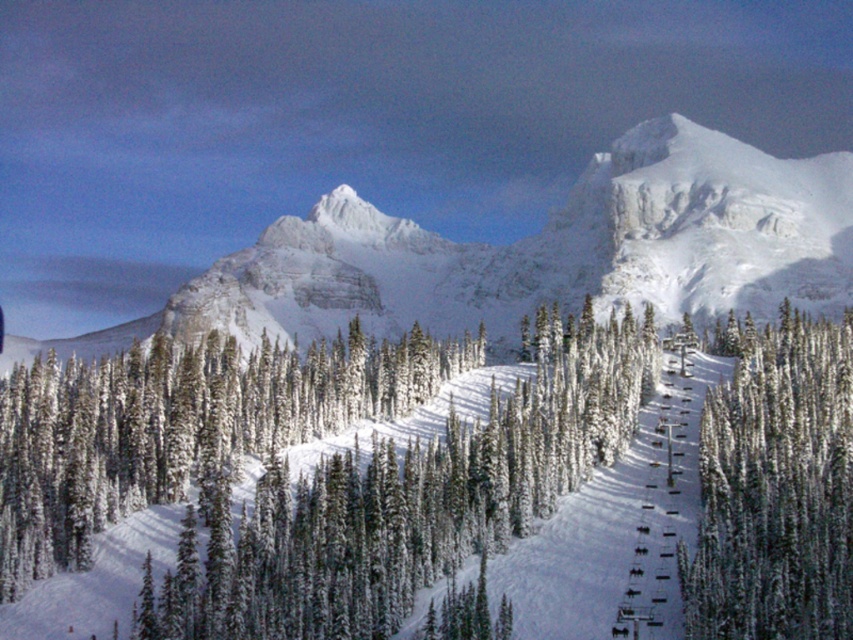
Question: Which point is farther to the camera?

Choices:
 (A) white snow-covered mountain at center
 (B) green snow-covered trees at center-right

Answer: (A)

Question: Which point is farther to the camera?

Choices:
 (A) (235, 285)
 (B) (784, 554)

Answer: (A)

Question: Which point appears farthest from the camera in this image?

Choices:
 (A) (834, 440)
 (B) (611, 208)

Answer: (B)

Question: Does white snow-covered mountain at center have a lesser width compared to green snow-covered trees at center-right?

Choices:
 (A) no
 (B) yes

Answer: (A)

Question: Can you confirm if white snow-covered mountain at center is smaller than green snow-covered trees at center-right?

Choices:
 (A) no
 (B) yes

Answer: (A)

Question: Can you confirm if white snow-covered mountain at center is wider than green snow-covered trees at center-right?

Choices:
 (A) no
 (B) yes

Answer: (B)